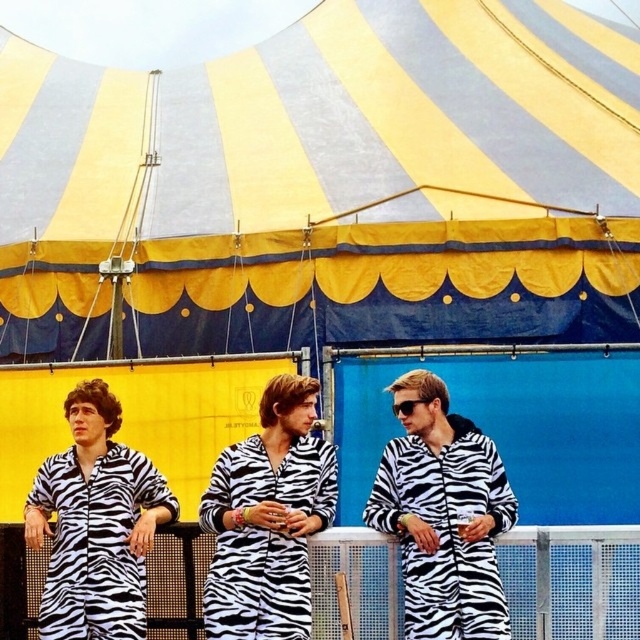
You are standing in front of the striped tent and see the zebra patterned onesie at center. What is located at the point with coordinates (x=442, y=515)?

The zebra patterned onesie at center is located at point (x=442, y=515).

You are taking a photo of the striped tent and the three people in zebra onesies. You want to focus on the point closer to the camera. Which point should you choose between point [1,124] and point [394,381]?

Point [1,124] is further to the camera than point [394,381], so you should choose point [1,124] to focus on the closer point.